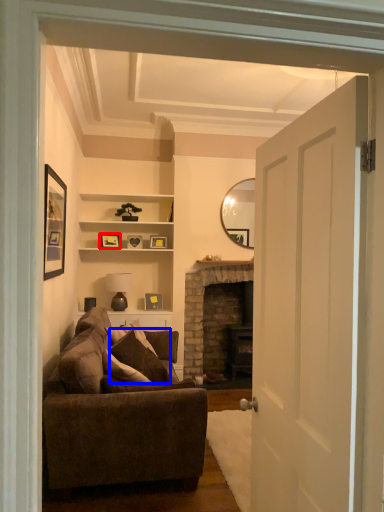
Question: Which of the following is the farthest to the observer, picture frame (highlighted by a red box) or pillow (highlighted by a blue box)?

Choices:
 (A) picture frame
 (B) pillow

Answer: (A)